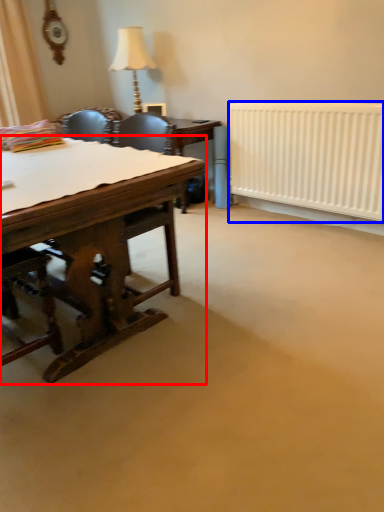
Question: Which point is closer to the camera, desk (highlighted by a red box) or radiator (highlighted by a blue box)?

Choices:
 (A) desk
 (B) radiator

Answer: (A)